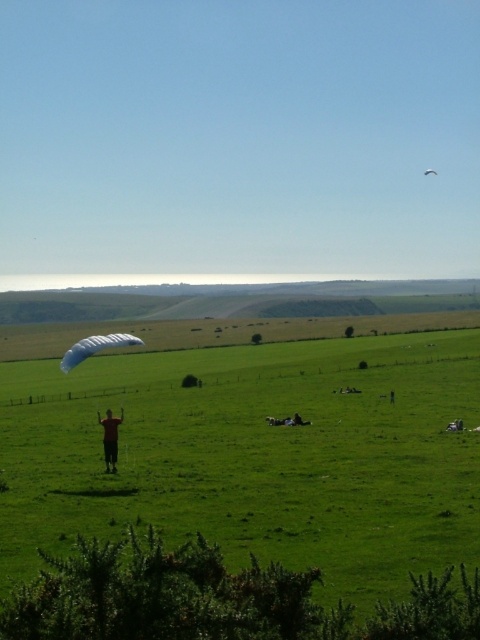
Can you confirm if white matte parachute at lower left is wider than white fabric parachute at upper center?

Yes.

Is point (95, 348) closer to camera compared to point (433, 173)?

Yes, it is in front of point (433, 173).

Does point (75, 342) lie behind point (424, 172)?

No, it is in front of (424, 172).

In order to click on white matte parachute at lower left in this screenshot , I will do `click(96, 348)`.

Between dark brown leather jacket at center and white fabric parachute at upper center, which one is positioned lower?

dark brown leather jacket at center

From the picture: Who is more distant from viewer, (113,468) or (431,168)?

Point (431,168)

Where is `dark brown leather jacket at center`? This screenshot has width=480, height=640. dark brown leather jacket at center is located at coordinates (109, 438).

Is green grassy field at center bigger than white fabric parachute at upper center?

Correct, green grassy field at center is larger in size than white fabric parachute at upper center.

Can you confirm if green grassy field at center is smaller than white fabric parachute at upper center?

Actually, green grassy field at center might be larger than white fabric parachute at upper center.

Between point (459, 481) and point (423, 172), which one is positioned behind?

Point (423, 172)

Locate an element on the screen. green grassy field at center is located at coordinates (244, 493).